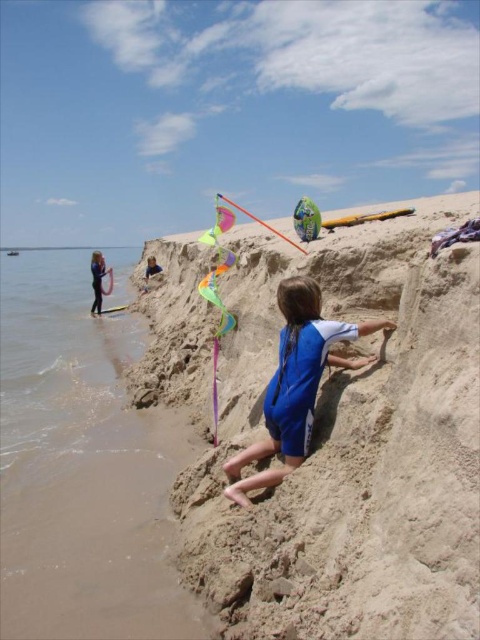
Does smooth sandcastle at center have a lesser width compared to brown sand at lower left?

Yes, smooth sandcastle at center is thinner than brown sand at lower left.

Image resolution: width=480 pixels, height=640 pixels. Identify the location of smooth sandcastle at center. (351, 445).

Where is `smooth sandcastle at center`? The image size is (480, 640). smooth sandcastle at center is located at coordinates (351, 445).

Locate an element on the screen. smooth sandcastle at center is located at coordinates (351, 445).

Is smooth sandcastle at center to the right of blue fabric child at center from the viewer's perspective?

Incorrect, smooth sandcastle at center is not on the right side of blue fabric child at center.

Is smooth sandcastle at center closer to the viewer compared to blue fabric child at center?

Yes, smooth sandcastle at center is closer to the viewer.

This screenshot has height=640, width=480. I want to click on smooth sandcastle at center, so click(351, 445).

Does brown sand at lower left have a lesser height compared to blue swimsuit at left?

Yes, brown sand at lower left is shorter than blue swimsuit at left.

Who is higher up, brown sand at lower left or blue swimsuit at left?

blue swimsuit at left is above.

Who is more distant from viewer, [108,301] or [95,280]?

The point [108,301] is behind.

Locate an element on the screen. brown sand at lower left is located at coordinates (80, 468).